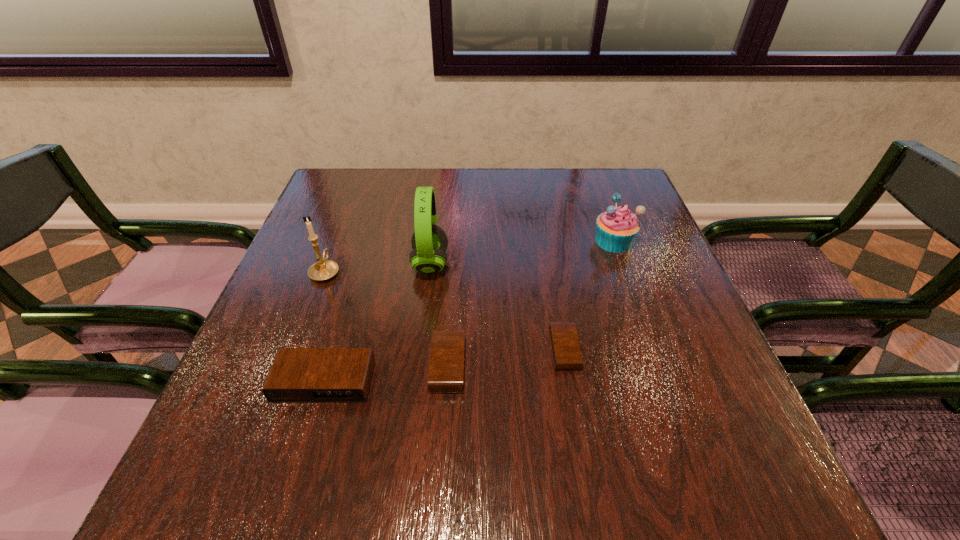
Point out which alarm clock is positioned as the nearest to the rightmost alarm clock. Please provide its 2D coordinates. Your answer should be formatted as a tuple, i.e. [(x, y)], where the tuple contains the x and y coordinates of a point satisfying the conditions above.

[(447, 360)]

I want to click on alarm clock that is the closest to the candle holder, so click(298, 375).

This screenshot has height=540, width=960. What are the coordinates of `free space that satisfies the following two spatial constraints: 1. on the handle side of the third tallest object; 2. on the left side of the candle holder` in the screenshot? It's located at (337, 241).